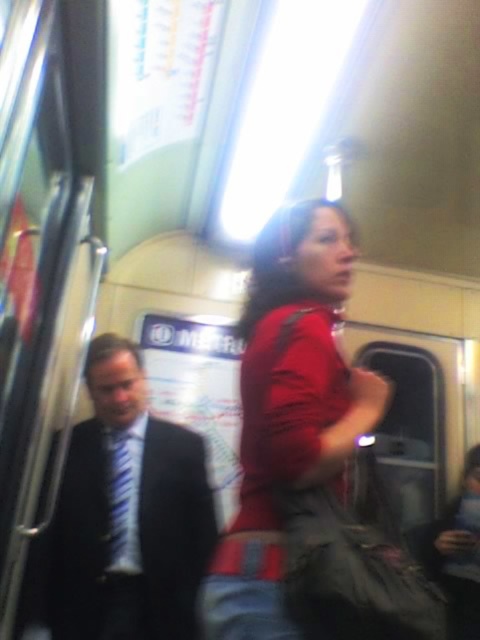
Question: Which point appears farthest from the camera in this image?

Choices:
 (A) (108, 602)
 (B) (274, 364)

Answer: (A)

Question: Is matte red shirt at center wider than blue striped tie at left?

Choices:
 (A) yes
 (B) no

Answer: (B)

Question: Is matte red shirt at center smaller than blue striped tie at left?

Choices:
 (A) no
 (B) yes

Answer: (B)

Question: Which point is farther from the camera taking this photo?

Choices:
 (A) (143, 404)
 (B) (311, 429)

Answer: (A)

Question: Is matte red shirt at center to the right of blue striped tie at left from the viewer's perspective?

Choices:
 (A) no
 (B) yes

Answer: (B)